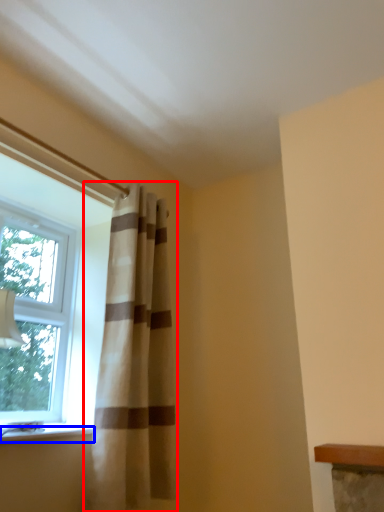
Question: Which object is closer to the camera taking this photo, curtain (highlighted by a red box) or window sill (highlighted by a blue box)?

Choices:
 (A) curtain
 (B) window sill

Answer: (B)